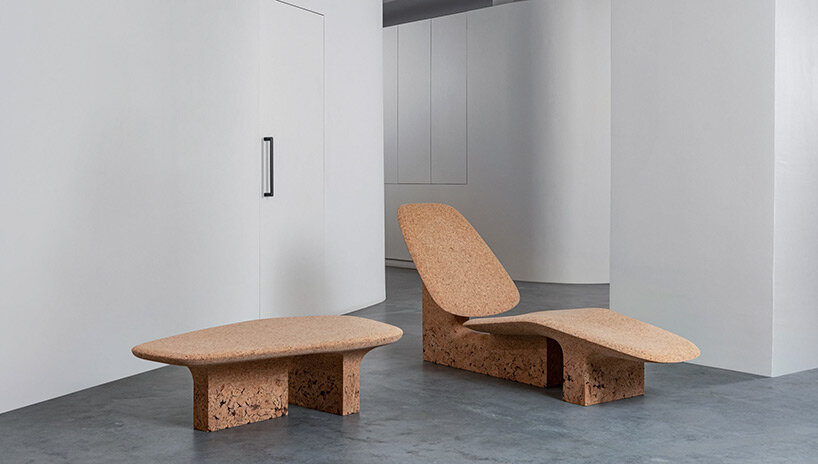
The width and height of the screenshot is (818, 464). Identify the location of empty wall space. (97, 153).